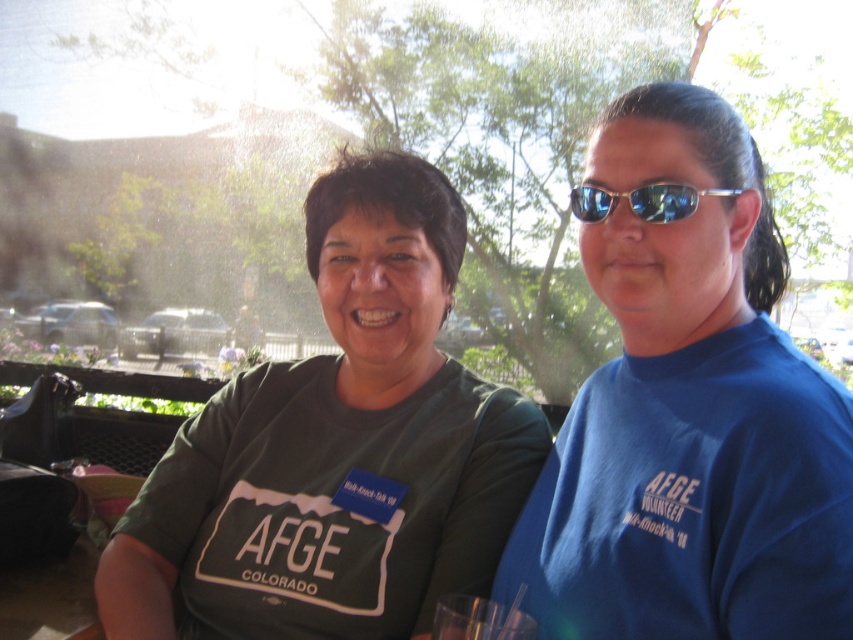
Question: Among these points, which one is farthest from the camera?

Choices:
 (A) (579, 220)
 (B) (822, 392)
 (C) (291, 413)

Answer: (C)

Question: Estimate the real-world distances between objects in this image. Which object is closer to the green matte shirt at center?

Choices:
 (A) blue t-shirt at center
 (B) sunglasses at right

Answer: (A)

Question: Is green matte shirt at center behind sunglasses at right?

Choices:
 (A) no
 (B) yes

Answer: (B)

Question: Does blue t-shirt at center appear over green matte shirt at center?

Choices:
 (A) no
 (B) yes

Answer: (B)

Question: Which object is the farthest from the sunglasses at right?

Choices:
 (A) blue t-shirt at center
 (B) green matte shirt at center

Answer: (B)

Question: Can you confirm if blue t-shirt at center is positioned above green matte shirt at center?

Choices:
 (A) yes
 (B) no

Answer: (A)